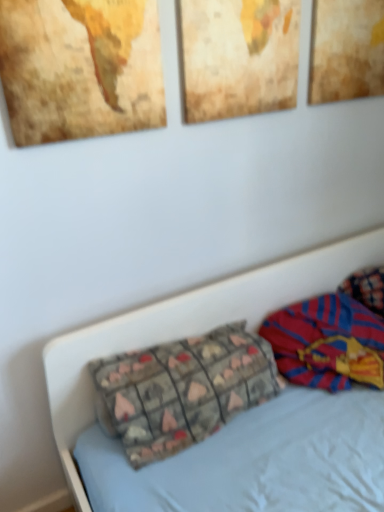
At what (x,y) coordinates should I click in order to perform the action: click on striped fabric blanket at right. Please return your answer as a coordinate pair (x, y). The width and height of the screenshot is (384, 512). Looking at the image, I should click on (327, 342).

Find the location of a particular element. textured paper picture frame at upper right, which is the third picture frame in left-to-right order is located at coordinates (347, 50).

What do you see at coordinates (184, 389) in the screenshot? I see `textured fabric pillow at center` at bounding box center [184, 389].

The width and height of the screenshot is (384, 512). Find the location of `striped fabric blanket at right`. striped fabric blanket at right is located at coordinates pyautogui.click(x=327, y=342).

From the image's perspective, which is below, striped fabric blanket at right or wooden textured picture frame at upper center, placed as the 2th picture frame when sorted from left to right?

striped fabric blanket at right, from the image's perspective.

Considering the relative sizes of striped fabric blanket at right and wooden textured picture frame at upper center, placed as the 2th picture frame when sorted from left to right, in the image provided, is striped fabric blanket at right taller than wooden textured picture frame at upper center, placed as the 2th picture frame when sorted from left to right,?

No.

Could you tell me if striped fabric blanket at right is turned towards wooden textured picture frame at upper center, placed as the 2th picture frame when sorted from left to right?

No, striped fabric blanket at right is not facing towards wooden textured picture frame at upper center, placed as the 2th picture frame when sorted from left to right.

Is wooden map at upper left, which appears as the 3th picture frame when viewed from the right, oriented away from textured fabric pillow at center?

wooden map at upper left, which appears as the 3th picture frame when viewed from the right, is not turned away from textured fabric pillow at center.

From a real-world perspective, is wooden map at upper left, which appears as the 3th picture frame when viewed from the right, located beneath textured fabric pillow at center?

Actually, wooden map at upper left, which appears as the 3th picture frame when viewed from the right, is physically above textured fabric pillow at center in the real world.

Is wooden map at upper left, which appears as the 3th picture frame when viewed from the right, spatially inside textured fabric pillow at center, or outside of it?

wooden map at upper left, which appears as the 3th picture frame when viewed from the right, is located beyond the bounds of textured fabric pillow at center.

Between point (26, 140) and point (212, 342), which one is positioned behind?

The point (212, 342) is behind.

Where is `the 2nd picture frame behind the textured fabric pillow at center, starting your count from the anchor`? The height and width of the screenshot is (512, 384). the 2nd picture frame behind the textured fabric pillow at center, starting your count from the anchor is located at coordinates (x=347, y=50).

Is textured fabric pillow at center in contact with textured paper picture frame at upper right, the 1th picture frame positioned from the right?

No, textured fabric pillow at center is not beside textured paper picture frame at upper right, the 1th picture frame positioned from the right.

Is textured fabric pillow at center positioned with its back to textured paper picture frame at upper right, the 1th picture frame positioned from the right?

No, textured fabric pillow at center's orientation is not away from textured paper picture frame at upper right, the 1th picture frame positioned from the right.

What's the angular difference between textured fabric pillow at center and textured paper picture frame at upper right, the 1th picture frame positioned from the right,'s facing directions?

They differ by 0.203 degrees in their facing directions.

How different are the orientations of textured fabric pillow at center and wooden textured picture frame at upper center, placed as the 2th picture frame when sorted from left to right, in degrees?

The angular difference between textured fabric pillow at center and wooden textured picture frame at upper center, placed as the 2th picture frame when sorted from left to right, is 0.204 degrees.

From a real-world perspective, is textured fabric pillow at center physically located above or below wooden textured picture frame at upper center, placed as the 2th picture frame when sorted from right to left?

In terms of real-world spatial position, textured fabric pillow at center is below wooden textured picture frame at upper center, placed as the 2th picture frame when sorted from right to left.

In terms of size, does textured fabric pillow at center appear bigger or smaller than wooden textured picture frame at upper center, placed as the 2th picture frame when sorted from left to right?

Clearly, textured fabric pillow at center is larger in size than wooden textured picture frame at upper center, placed as the 2th picture frame when sorted from left to right.

From the image's perspective, is textured fabric pillow at center below wooden textured picture frame at upper center, placed as the 2th picture frame when sorted from left to right?

Yes.

Locate an element on the screen. the 2nd picture frame to the left of the textured paper picture frame at upper right, which is the third picture frame in left-to-right order, counting from the anchor's position is located at coordinates (80, 68).

Is textured paper picture frame at upper right, which is the third picture frame in left-to-right order, touching wooden map at upper left, which appears as the 3th picture frame when viewed from the right?

textured paper picture frame at upper right, which is the third picture frame in left-to-right order, and wooden map at upper left, which appears as the 3th picture frame when viewed from the right, are not in contact.

Does textured paper picture frame at upper right, the 1th picture frame positioned from the right, appear on the right side of wooden map at upper left, which is the first picture frame from left to right?

Correct, you'll find textured paper picture frame at upper right, the 1th picture frame positioned from the right, to the right of wooden map at upper left, which is the first picture frame from left to right.

Consider the image. In the image, is textured paper picture frame at upper right, which is the third picture frame in left-to-right order, on the left side or the right side of striped fabric blanket at right?

textured paper picture frame at upper right, which is the third picture frame in left-to-right order, is positioned on striped fabric blanket at right's right side.

Is textured paper picture frame at upper right, which is the third picture frame in left-to-right order, located outside striped fabric blanket at right?

Indeed, textured paper picture frame at upper right, which is the third picture frame in left-to-right order, is completely outside striped fabric blanket at right.

From the image's perspective, which one is positioned higher, textured paper picture frame at upper right, which is the third picture frame in left-to-right order, or striped fabric blanket at right?

textured paper picture frame at upper right, which is the third picture frame in left-to-right order, from the image's perspective.

From a real-world perspective, which is physically below, textured paper picture frame at upper right, which is the third picture frame in left-to-right order, or striped fabric blanket at right?

striped fabric blanket at right, from a real-world perspective.

From the image's perspective, which object appears higher, textured fabric pillow at center or striped fabric blanket at right?

striped fabric blanket at right, from the image's perspective.

Visually, is textured fabric pillow at center positioned to the left or to the right of striped fabric blanket at right?

textured fabric pillow at center is to the left of striped fabric blanket at right.

Which point is more distant from viewer, (150,390) or (320,367)?

Positioned behind is point (320,367).

Image resolution: width=384 pixels, height=512 pixels. In order to click on pillow below the striped fabric blanket at right (from the image's perspective) in this screenshot , I will do `click(184, 389)`.

Locate an element on the screen. The height and width of the screenshot is (512, 384). the 1st picture frame in front of the striped fabric blanket at right, counting from the anchor's position is located at coordinates (239, 56).

From the image's perspective, which picture frame is the 1st one above the textured fabric pillow at center? Please provide its 2D coordinates.

[(80, 68)]

Based on the photo, estimate the real-world distances between objects in this image. Which object is further from wooden textured picture frame at upper center, placed as the 2th picture frame when sorted from left to right, textured fabric pillow at center or wooden map at upper left, which appears as the 3th picture frame when viewed from the right?

The object further to wooden textured picture frame at upper center, placed as the 2th picture frame when sorted from left to right, is textured fabric pillow at center.

From the image, which object appears to be farther from wooden textured picture frame at upper center, placed as the 2th picture frame when sorted from right to left, textured fabric pillow at center or striped fabric blanket at right?

striped fabric blanket at right.

Considering their positions, is textured paper picture frame at upper right, the 1th picture frame positioned from the right, positioned closer to wooden map at upper left, which is the first picture frame from left to right, than textured fabric pillow at center?

Based on the image, textured paper picture frame at upper right, the 1th picture frame positioned from the right, appears to be nearer to wooden map at upper left, which is the first picture frame from left to right.

Based on their spatial positions, is wooden textured picture frame at upper center, placed as the 2th picture frame when sorted from right to left, or wooden map at upper left, which appears as the 3th picture frame when viewed from the right, closer to textured paper picture frame at upper right, which is the third picture frame in left-to-right order?

wooden textured picture frame at upper center, placed as the 2th picture frame when sorted from right to left, is closer to textured paper picture frame at upper right, which is the third picture frame in left-to-right order.

Considering their positions, is textured paper picture frame at upper right, which is the third picture frame in left-to-right order, positioned further to wooden map at upper left, which is the first picture frame from left to right, than striped fabric blanket at right?

striped fabric blanket at right is further to wooden map at upper left, which is the first picture frame from left to right.

Considering their positions, is wooden map at upper left, which is the first picture frame from left to right, positioned closer to wooden textured picture frame at upper center, placed as the 2th picture frame when sorted from left to right, than textured fabric pillow at center?

The object closer to wooden textured picture frame at upper center, placed as the 2th picture frame when sorted from left to right, is wooden map at upper left, which is the first picture frame from left to right.

Looking at the image, which one is located closer to textured paper picture frame at upper right, the 1th picture frame positioned from the right, wooden map at upper left, which appears as the 3th picture frame when viewed from the right, or textured fabric pillow at center?

The object closer to textured paper picture frame at upper right, the 1th picture frame positioned from the right, is wooden map at upper left, which appears as the 3th picture frame when viewed from the right.

Estimate the real-world distances between objects in this image. Which object is further from wooden textured picture frame at upper center, placed as the 2th picture frame when sorted from left to right, textured paper picture frame at upper right, which is the third picture frame in left-to-right order, or textured fabric pillow at center?

Among the two, textured fabric pillow at center is located further to wooden textured picture frame at upper center, placed as the 2th picture frame when sorted from left to right.

Image resolution: width=384 pixels, height=512 pixels. In order to click on picture frame between wooden textured picture frame at upper center, placed as the 2th picture frame when sorted from right to left, and textured fabric pillow at center in the up-down direction in this screenshot , I will do `click(80, 68)`.

The image size is (384, 512). What are the coordinates of `material between textured paper picture frame at upper right, which is the third picture frame in left-to-right order, and textured fabric pillow at center vertically` in the screenshot? It's located at (327, 342).

Locate an element on the screen. Image resolution: width=384 pixels, height=512 pixels. material between wooden textured picture frame at upper center, placed as the 2th picture frame when sorted from left to right, and textured fabric pillow at center vertically is located at coordinates (327, 342).

You are a GUI agent. You are given a task and a screenshot of the screen. Output one action in this format:
    pyautogui.click(x=<x>, y=<y>)
    Task: Click on the material between wooden map at upper left, which is the first picture frame from left to right, and textured fabric pillow at center vertically
    
    Given the screenshot: What is the action you would take?
    pyautogui.click(x=327, y=342)